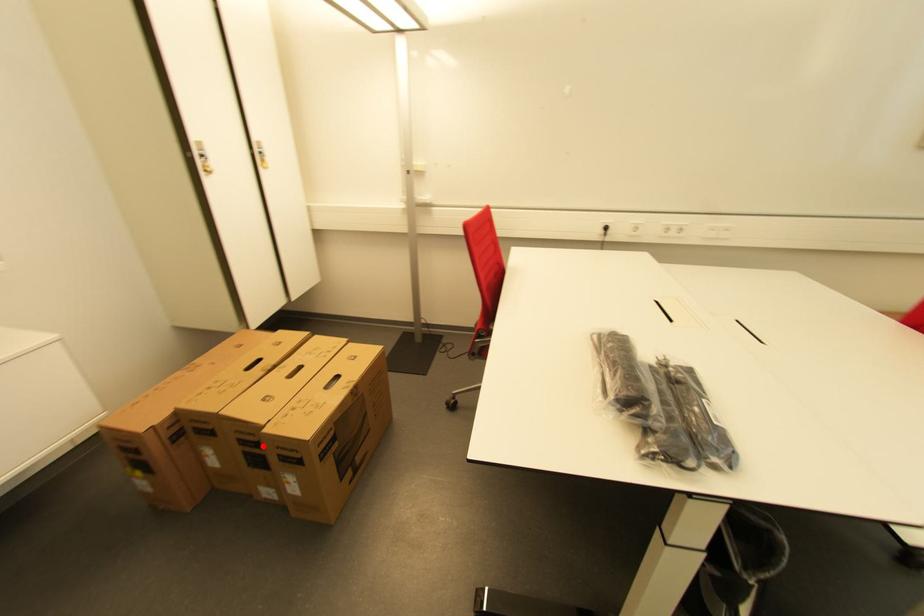
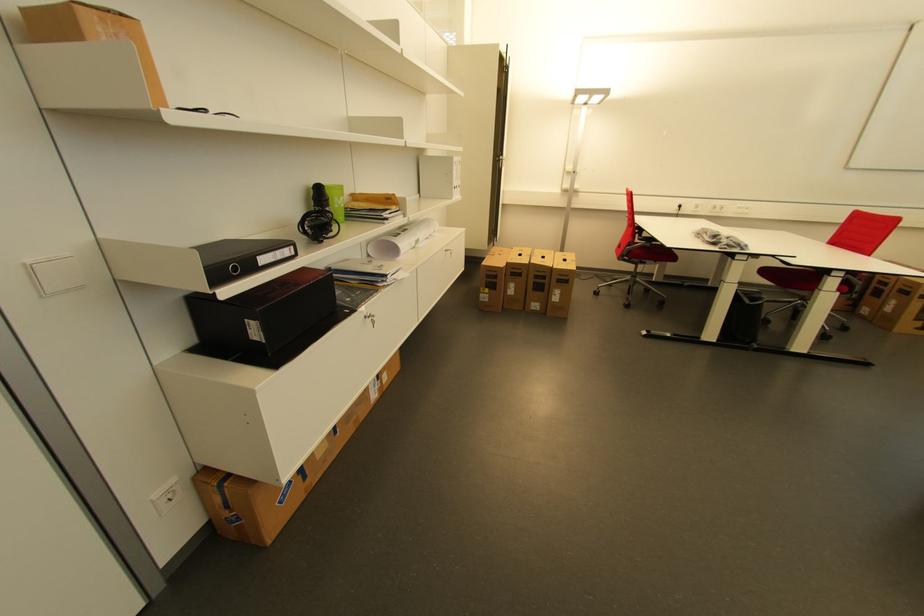
Locate, in the second image, the point that corresponds to the highlighted location in the first image.

(550, 278)